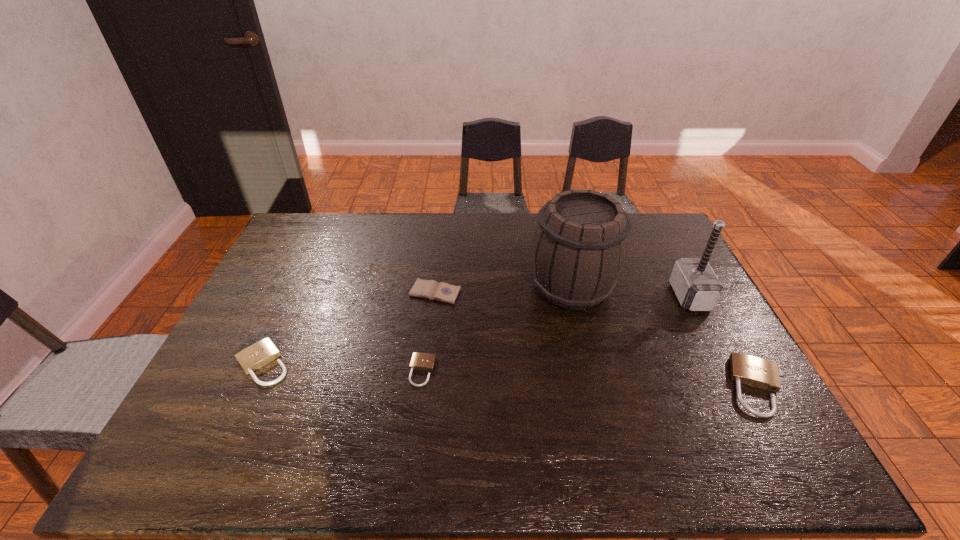
Where is `the fourth tallest object`? the fourth tallest object is located at coordinates (252, 358).

You are a GUI agent. You are given a task and a screenshot of the screen. Output one action in this format:
    pyautogui.click(x=<x>, y=<y>)
    Task: Click on the leftmost padlock
    The width and height of the screenshot is (960, 540).
    Given the screenshot: What is the action you would take?
    pyautogui.click(x=252, y=358)

In order to click on the second padlock from left to right in this screenshot , I will do `click(420, 361)`.

Find the location of a particular element. Image resolution: width=960 pixels, height=540 pixels. the rightmost padlock is located at coordinates (745, 369).

Locate an element on the screen. the fourth object from left to right is located at coordinates (580, 245).

The image size is (960, 540). In order to click on diary in this screenshot , I will do `click(431, 289)`.

Identify the location of hammer. (697, 287).

The width and height of the screenshot is (960, 540). In order to click on vacant space located on the back of the leftmost object in this screenshot , I will do `click(313, 255)`.

Where is `vacant region located 0.200m on the right of the shortest padlock`? vacant region located 0.200m on the right of the shortest padlock is located at coordinates (512, 371).

Find the location of a particular element. vacant area located 0.130m on the left of the rightmost padlock is located at coordinates (677, 387).